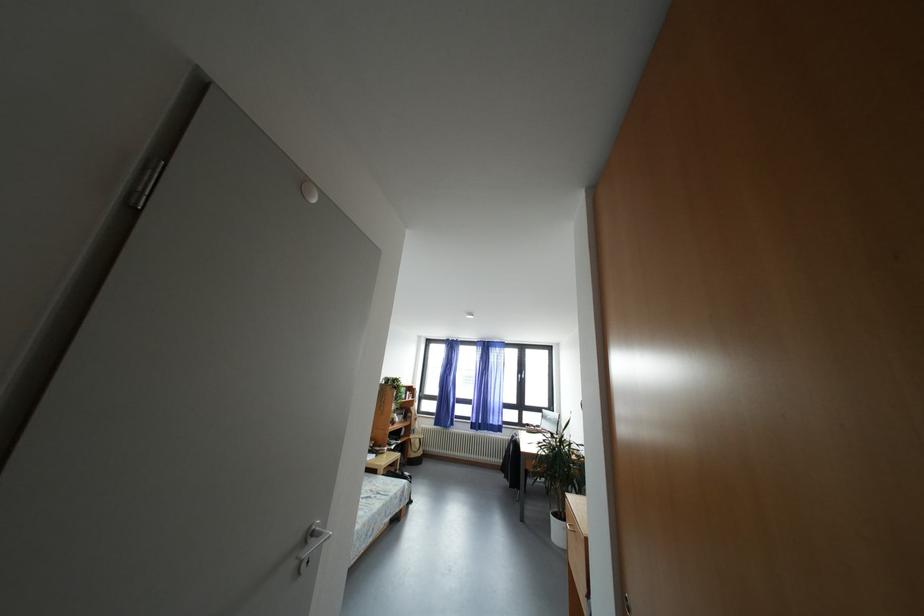
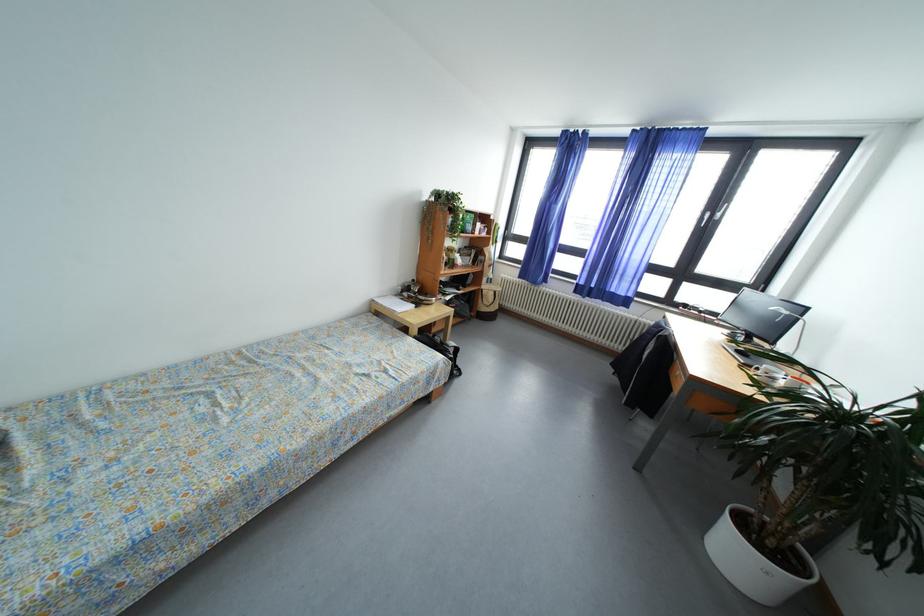
Locate, in the second image, the point that corresponds to pixel 409 394 in the first image.

(477, 223)